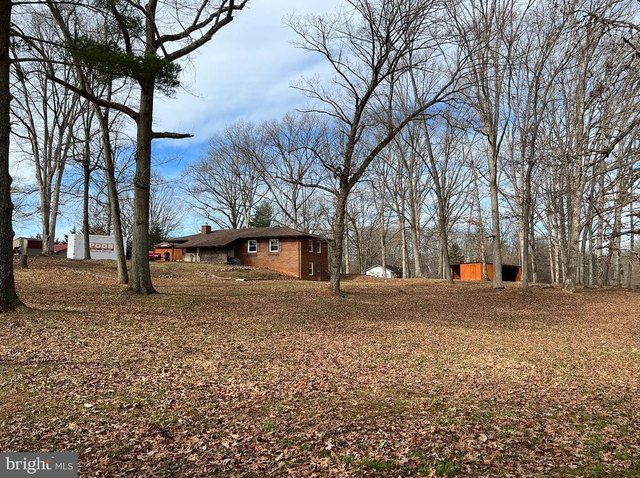
Image resolution: width=640 pixels, height=478 pixels. Identify the location of doors. (317, 271), (230, 255).